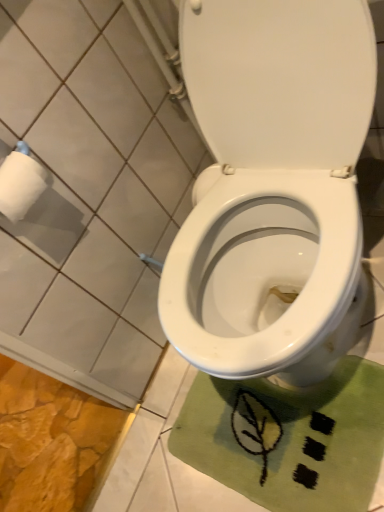
Question: Is green fabric bath mat at lower right oriented towards white matte toilet paper at upper left?

Choices:
 (A) no
 (B) yes

Answer: (A)

Question: Is green fabric bath mat at lower right not near white matte toilet paper at upper left?

Choices:
 (A) yes
 (B) no

Answer: (B)

Question: Is white matte toilet paper at upper left surrounded by green fabric bath mat at lower right?

Choices:
 (A) yes
 (B) no

Answer: (B)

Question: Can you confirm if green fabric bath mat at lower right is taller than white matte toilet paper at upper left?

Choices:
 (A) yes
 (B) no

Answer: (B)

Question: From the image's perspective, is green fabric bath mat at lower right above white matte toilet paper at upper left?

Choices:
 (A) no
 (B) yes

Answer: (A)

Question: Can you confirm if green fabric bath mat at lower right is bigger than white matte toilet paper at upper left?

Choices:
 (A) yes
 (B) no

Answer: (A)

Question: Is white matte toilet paper at upper left not close to green fabric bath mat at lower right?

Choices:
 (A) yes
 (B) no

Answer: (B)

Question: From the image's perspective, is white matte toilet paper at upper left over green fabric bath mat at lower right?

Choices:
 (A) no
 (B) yes

Answer: (B)

Question: Is the surface of white matte toilet paper at upper left in direct contact with green fabric bath mat at lower right?

Choices:
 (A) no
 (B) yes

Answer: (A)

Question: Is white matte toilet paper at upper left oriented towards green fabric bath mat at lower right?

Choices:
 (A) yes
 (B) no

Answer: (B)

Question: Can you confirm if white matte toilet paper at upper left is positioned to the right of green fabric bath mat at lower right?

Choices:
 (A) no
 (B) yes

Answer: (A)

Question: Considering the relative sizes of white matte toilet paper at upper left and green fabric bath mat at lower right in the image provided, is white matte toilet paper at upper left smaller than green fabric bath mat at lower right?

Choices:
 (A) no
 (B) yes

Answer: (B)

Question: Would you say white matte toilet paper at upper left is to the left or to the right of green fabric bath mat at lower right in the picture?

Choices:
 (A) right
 (B) left

Answer: (B)